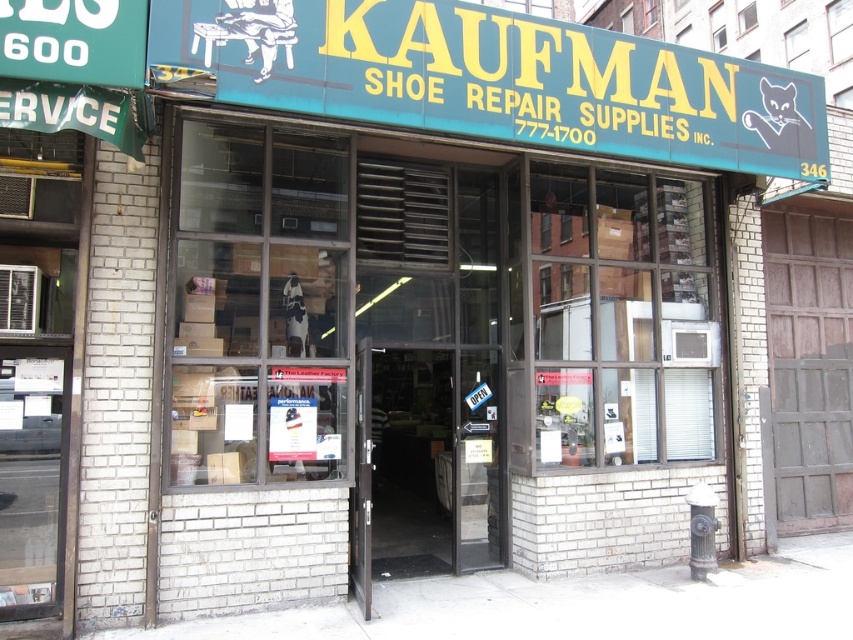
Is teal/yellow signboard at upper center taller than transparent glass door at center?

Yes.

Who is positioned more to the left, teal/yellow signboard at upper center or transparent glass door at center?

From the viewer's perspective, transparent glass door at center appears more on the left side.

Describe the element at coordinates (498, 77) in the screenshot. Image resolution: width=853 pixels, height=640 pixels. I see `teal/yellow signboard at upper center` at that location.

The width and height of the screenshot is (853, 640). I want to click on teal/yellow signboard at upper center, so click(498, 77).